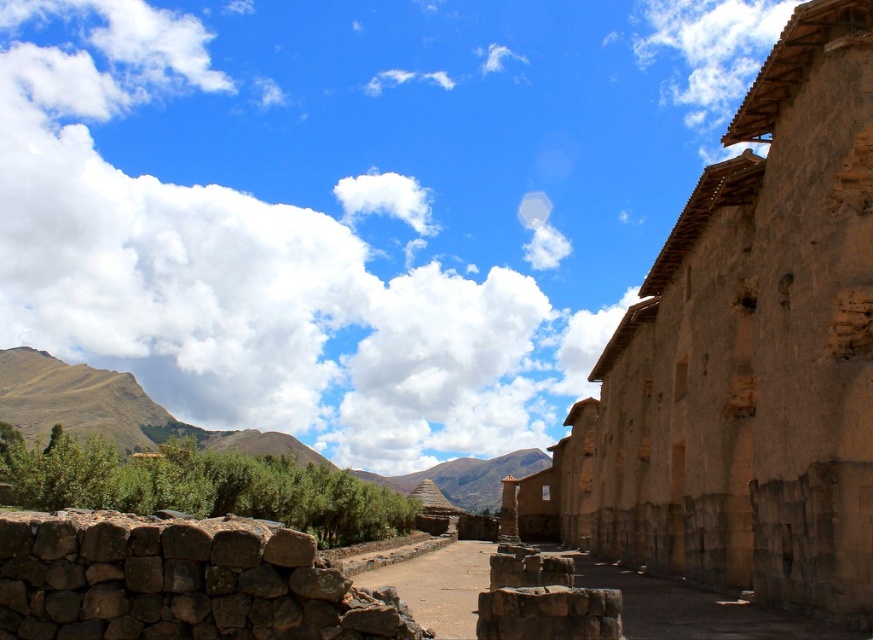
Question: Which point appears closest to the camera in this image?

Choices:
 (A) (500, 518)
 (B) (758, 403)

Answer: (B)

Question: Is the position of brown mudbrick ruins at right more distant than that of brown stone pillar at center?

Choices:
 (A) yes
 (B) no

Answer: (B)

Question: Which object appears closest to the camera in this image?

Choices:
 (A) brown stone pillar at center
 (B) brown mudbrick ruins at right

Answer: (B)

Question: Can you confirm if brown mudbrick ruins at right is bigger than brown stone pillar at center?

Choices:
 (A) no
 (B) yes

Answer: (B)

Question: Which object is farther from the camera taking this photo?

Choices:
 (A) brown stone pillar at center
 (B) brown mudbrick ruins at right

Answer: (A)

Question: In this image, where is brown mudbrick ruins at right located relative to brown stone pillar at center?

Choices:
 (A) above
 (B) below

Answer: (A)